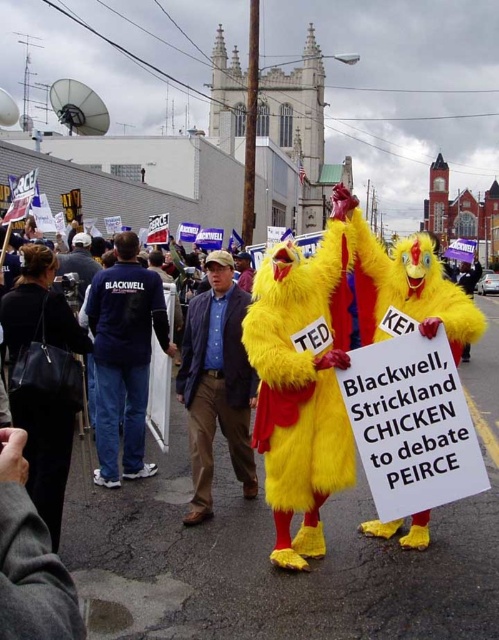
You are a photographer trying to capture both the blue denim shirt at center and the blue cotton shirt at center in a single frame. Which shirt should you focus on first to ensure both are in the frame?

The blue denim shirt at center has a lesser height compared to the blue cotton shirt at center, so you should focus on the taller blue cotton shirt at center first to ensure both are in the frame.

You are a photographer at the rally and want to take a photo of both the blue denim shirt at center and the blue cotton shirt at center. Which one should you focus on first if you want to capture the thinner one in sharp detail?

The blue denim shirt at center is thinner than the blue cotton shirt at center, so you should focus on the blue denim shirt at center first to capture its details sharply.

In the scene shown: You are a photographer trying to capture both the blue denim shirt at center and the blue cotton shirt at center in a single shot. Which shirt should you adjust your camera to focus on first to ensure both are in frame?

The blue denim shirt at center is to the right of the blue cotton shirt at center. To capture both in a single shot, focus on the blue cotton shirt at center first as it is on the left, then adjust the frame to include the blue denim shirt at center on the right.